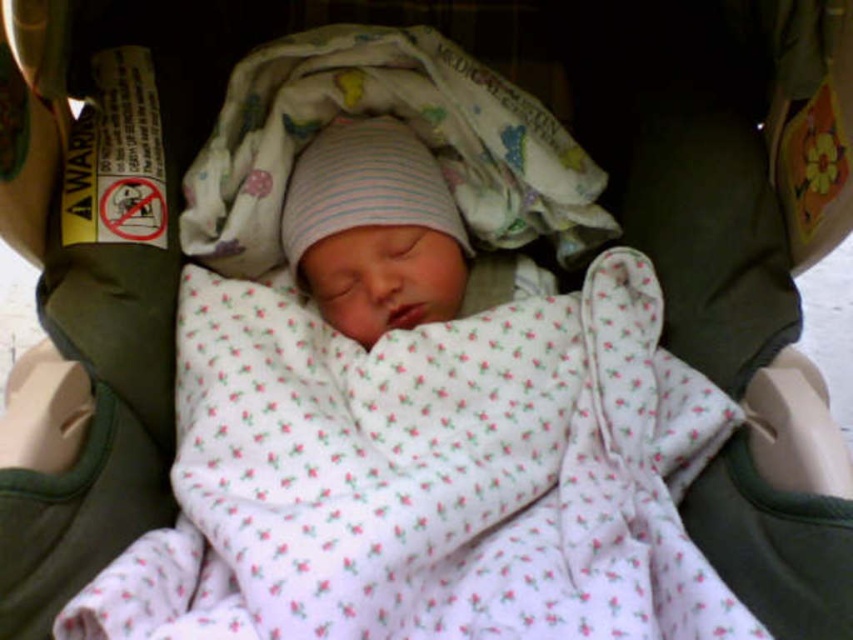
Question: Among these objects, which one is nearest to the camera?

Choices:
 (A) white floral fabric at center
 (B) white cotton blanket at center
 (C) white striped knit hat at center

Answer: (A)

Question: Is white floral fabric at center positioned at the back of white cotton blanket at center?

Choices:
 (A) no
 (B) yes

Answer: (A)

Question: Is white floral fabric at center positioned before white cotton blanket at center?

Choices:
 (A) no
 (B) yes

Answer: (B)

Question: Can you confirm if white floral fabric at center is positioned to the right of white striped knit hat at center?

Choices:
 (A) no
 (B) yes

Answer: (B)

Question: Which of the following is the closest to the observer?

Choices:
 (A) white floral fabric at center
 (B) white striped knit hat at center
 (C) white cotton blanket at center

Answer: (A)

Question: Considering the real-world distances, which object is closest to the white striped knit hat at center?

Choices:
 (A) white cotton blanket at center
 (B) white floral fabric at center

Answer: (A)